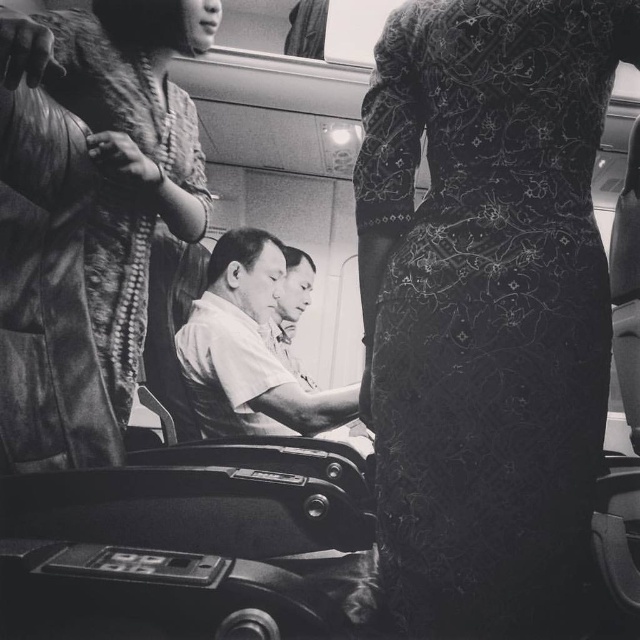
In the train scene, there is a smooth white shirt at center and a smooth skin man at center. Which object takes up more space in the image?

The smooth white shirt at center is bigger than the smooth skin man at center, so it takes up more space in the image.

You are a photographer who wants to capture a closeup shot of the fur coat at upper left without including the black lace dress at center in the frame. Is this possible given their positions?

The black lace dress at center is much taller than the fur coat at upper left, so the fur coat at upper left is shorter. Therefore, it might be possible to position the camera lower to avoid the taller black lace dress at center and focus on the shorter fur coat at upper left.